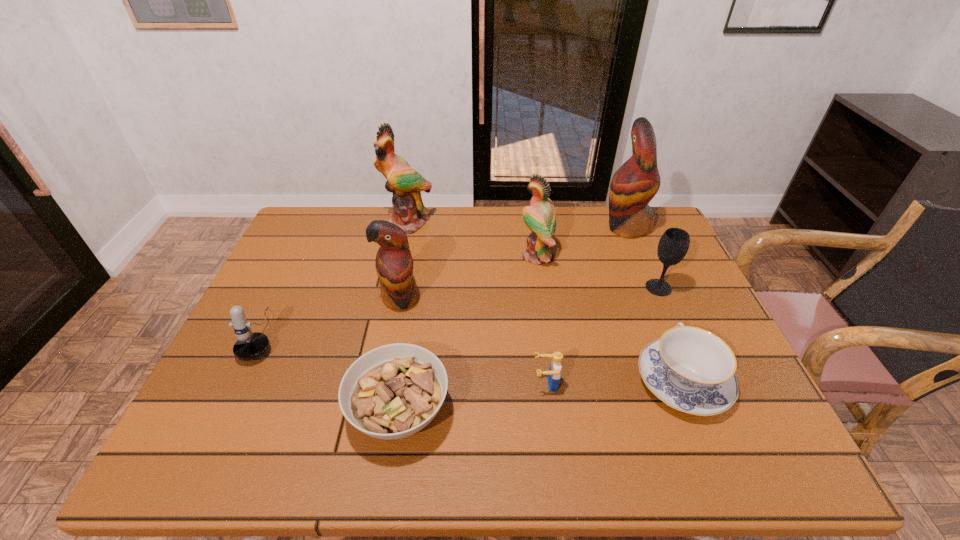
I want to click on vacant space situated 0.090m on the front-facing side of the smaller green parrot, so click(491, 256).

The height and width of the screenshot is (540, 960). Identify the location of vacant space located 0.250m on the face of the nearest parrot. (381, 396).

At what (x,y) coordinates should I click in order to perform the action: click on free location located on the back of the fifth tallest object. Please return your answer as a coordinate pair (x, y). Looking at the image, I should click on (625, 210).

Image resolution: width=960 pixels, height=540 pixels. What are the coordinates of `vacant space located 0.070m on the right of the white microphone` in the screenshot? It's located at (307, 335).

Where is `vacant space positioned on the face of the blue Lego`? vacant space positioned on the face of the blue Lego is located at coordinates (472, 384).

Where is `vacant space located on the face of the blue Lego`? vacant space located on the face of the blue Lego is located at coordinates (464, 384).

Image resolution: width=960 pixels, height=540 pixels. What are the coordinates of `vacant point located on the face of the blue Lego` in the screenshot? It's located at coord(390,384).

Identify the location of vacant space located with the handle on the side of the chinaware. (629, 247).

I want to click on free region located with the handle on the side of the chinaware, so click(628, 245).

The image size is (960, 540). I want to click on free region located with the handle on the side of the chinaware, so click(x=642, y=281).